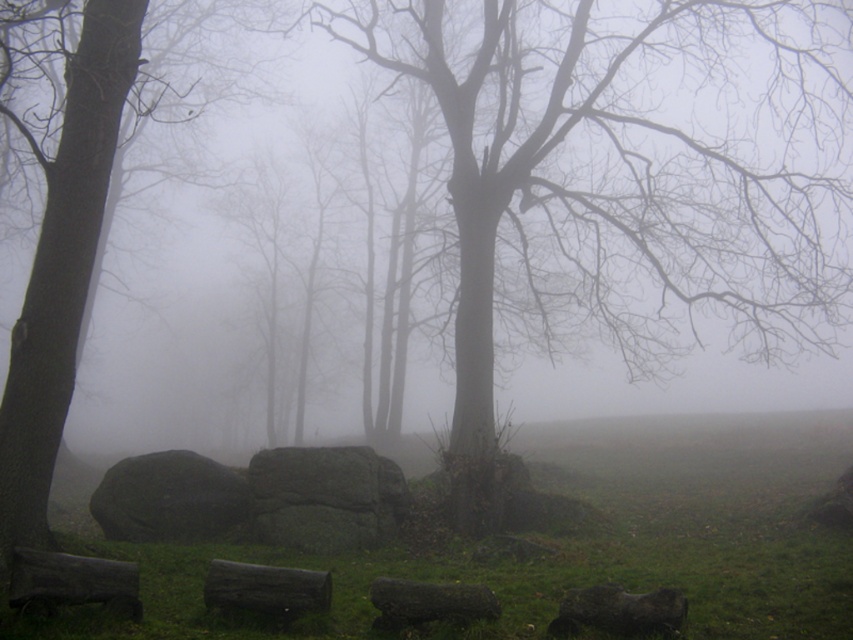
What do you see at coordinates (61, 224) in the screenshot? Image resolution: width=853 pixels, height=640 pixels. I see `smooth gray tree trunk at left` at bounding box center [61, 224].

Which is above, smooth gray tree trunk at left or dark brown wood at center?

Positioned higher is smooth gray tree trunk at left.

Is point (141, 60) more distant than point (289, 596)?

Yes, it is.

I want to click on smooth gray tree trunk at left, so click(x=61, y=224).

Is green mossy rock at center thinner than dark brown wood at lower left?

In fact, green mossy rock at center might be wider than dark brown wood at lower left.

Is green mossy rock at center wider than dark brown wood at lower left?

Yes.

Is point (248, 468) positioned in front of point (131, 616)?

No, it is behind (131, 616).

Image resolution: width=853 pixels, height=640 pixels. In order to click on green mossy rock at center in this screenshot , I will do `click(323, 497)`.

Can you confirm if rough gray rock at lower center is thinner than dark brown wood at center?

Yes.

Locate an element on the screen. The height and width of the screenshot is (640, 853). rough gray rock at lower center is located at coordinates (169, 499).

Find the location of a particular element. This screenshot has width=853, height=640. rough gray rock at lower center is located at coordinates (169, 499).